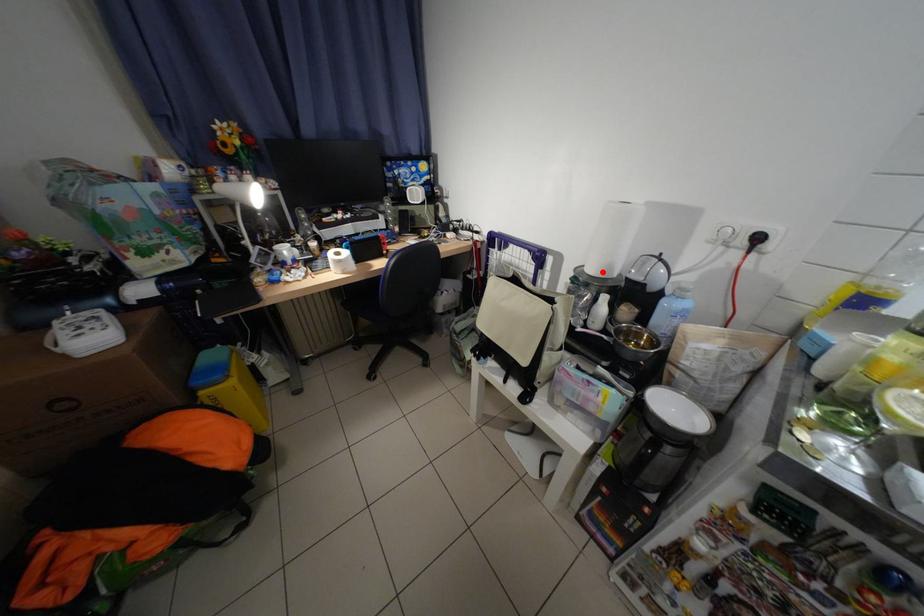
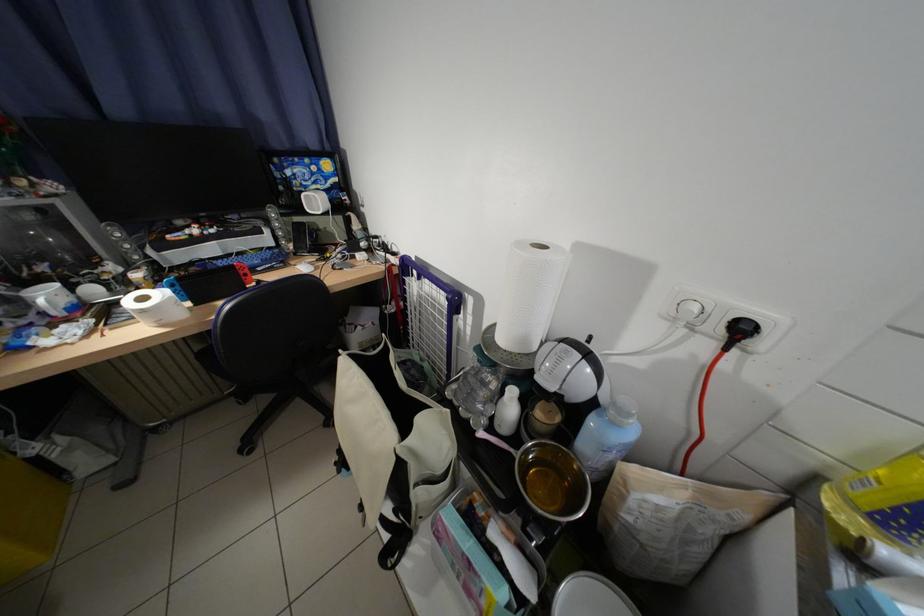
In the second image, find the point that corresponds to the highlighted location in the first image.

(514, 341)